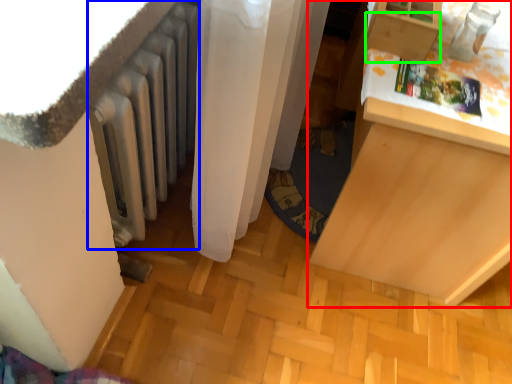
Question: Estimate the real-world distances between objects in this image. Which object is closer to furniture (highlighted by a red box), radiator (highlighted by a blue box) or drawer (highlighted by a green box)?

Choices:
 (A) radiator
 (B) drawer

Answer: (B)